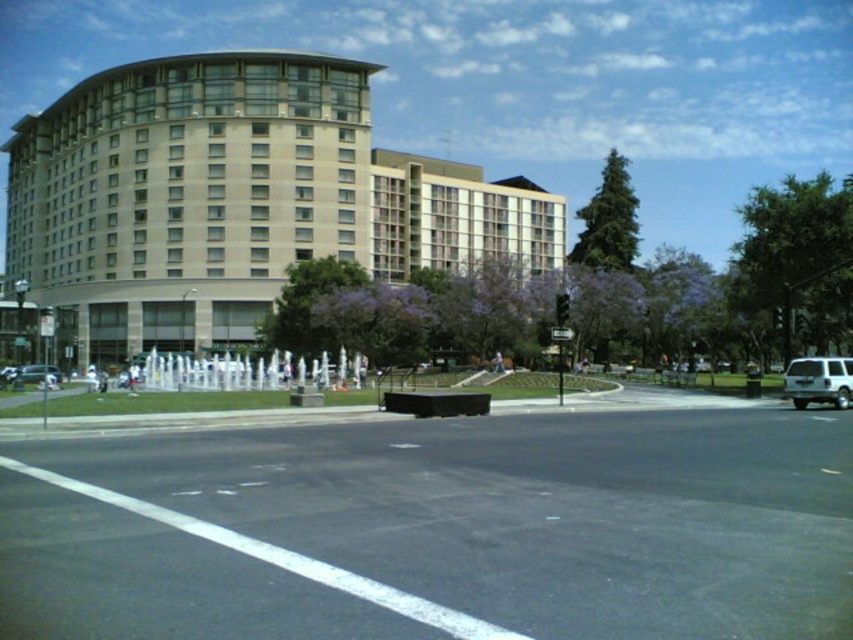
Who is positioned more to the right, beige glass building at upper left or silver metallic sedan at lower left?

silver metallic sedan at lower left is more to the right.

Between beige glass building at upper left and silver metallic sedan at lower left, which one has less height?

Standing shorter between the two is silver metallic sedan at lower left.

In order to click on beige glass building at upper left in this screenshot , I will do `click(236, 198)`.

Is white matte suv at right above silver metallic sedan at lower left?

Indeed, white matte suv at right is positioned over silver metallic sedan at lower left.

Does point (795, 392) lie in front of point (1, 371)?

That is True.

Which is in front, point (846, 365) or point (7, 372)?

Point (846, 365)

At what (x,y) coordinates should I click in order to perform the action: click on white matte suv at right. Please return your answer as a coordinate pair (x, y). Looking at the image, I should click on (819, 381).

Can you confirm if beige glass building at upper left is positioned to the right of white matte suv at right?

In fact, beige glass building at upper left is to the left of white matte suv at right.

Measure the distance between beige glass building at upper left and white matte suv at right.

94.50 meters

Is point (107, 349) closer to viewer compared to point (793, 365)?

No, it is behind (793, 365).

The width and height of the screenshot is (853, 640). In order to click on beige glass building at upper left in this screenshot , I will do `click(236, 198)`.